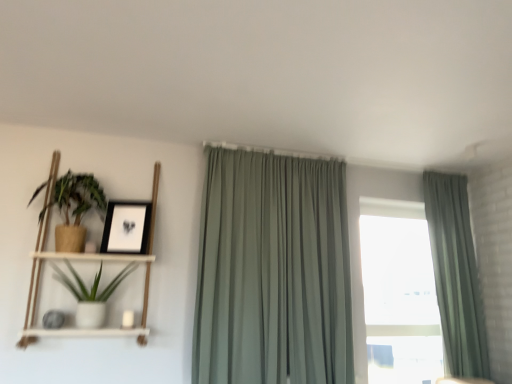
Question: Visually, is matte brown pot at left, positioned as the first houseplant in top-to-bottom order, positioned to the left or to the right of sage green fabric curtain at right, which is counted as the first curtain, starting from the right?

Choices:
 (A) left
 (B) right

Answer: (A)

Question: In terms of width, does matte brown pot at left, the 2th houseplant from the bottom, look wider or thinner when compared to sage green fabric curtain at right, which is counted as the first curtain, starting from the right?

Choices:
 (A) wide
 (B) thin

Answer: (A)

Question: Based on their relative distances, which object is farther from the matte brown pot at left, positioned as the first houseplant in top-to-bottom order?

Choices:
 (A) white matte pot at left, arranged as the 2th houseplant when viewed from the top
 (B) sage green fabric curtain at right, which is counted as the first curtain, starting from the right
 (C) sage green fabric curtain at center, acting as the second curtain starting from the right
 (D) white wood shelf at left
 (E) matte black picture frame at upper left

Answer: (B)

Question: Which object is the farthest from the matte black picture frame at upper left?

Choices:
 (A) sage green fabric curtain at center, acting as the first curtain starting from the left
 (B) white wood shelf at left
 (C) white matte pot at left, arranged as the 2th houseplant when viewed from the top
 (D) sage green fabric curtain at right, placed as the second curtain when sorted from left to right
 (E) matte brown pot at left, positioned as the first houseplant in top-to-bottom order

Answer: (D)